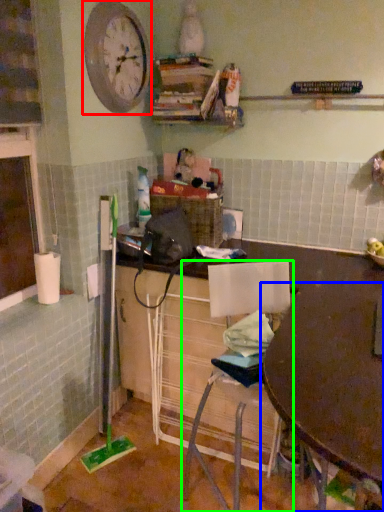
Question: Which object is the farthest from clock (highlighted by a red box)? Choose among these: table (highlighted by a blue box) or chair (highlighted by a green box).

Choices:
 (A) table
 (B) chair

Answer: (A)